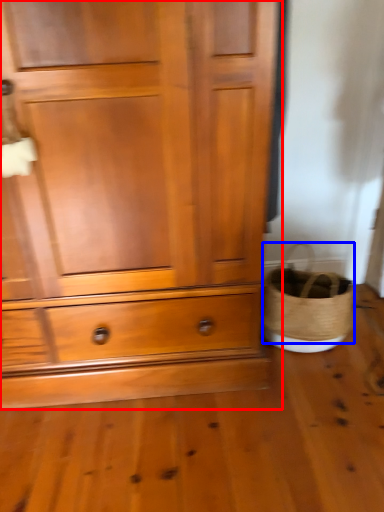
Question: Among these objects, which one is nearest to the camera, chest of drawers (highlighted by a red box) or basket (highlighted by a blue box)?

Choices:
 (A) chest of drawers
 (B) basket

Answer: (A)